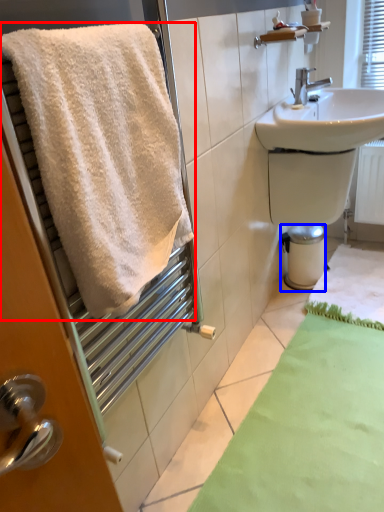
Question: Which point is further to the camera, towel (highlighted by a red box) or bidet (highlighted by a blue box)?

Choices:
 (A) towel
 (B) bidet

Answer: (B)